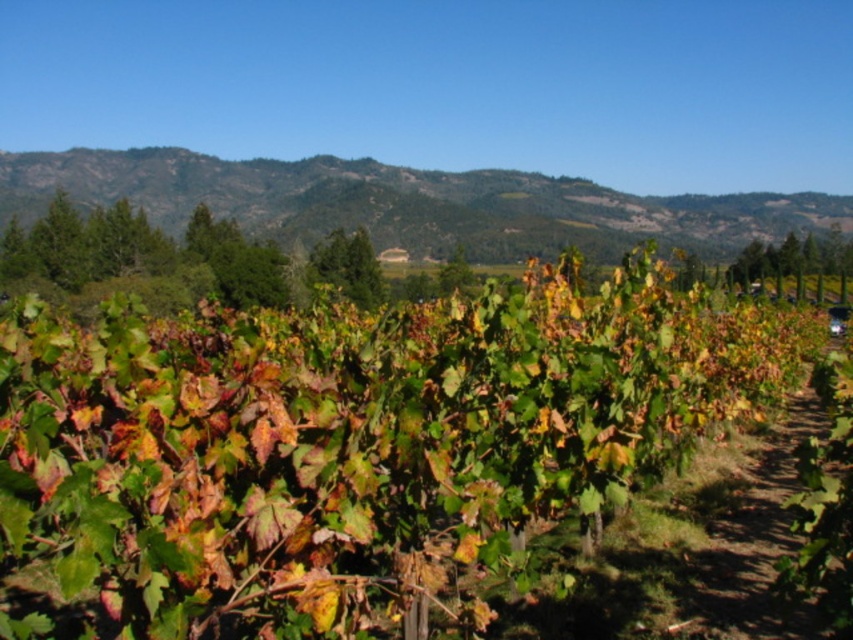
How distant is green leafy vegetation at upper center from dirt path at center?

A distance of 239.55 feet exists between green leafy vegetation at upper center and dirt path at center.

Can you confirm if green leafy vegetation at upper center is shorter than dirt path at center?

In fact, green leafy vegetation at upper center may be taller than dirt path at center.

Is point (341, 224) positioned after point (828, 442)?

Yes, it is behind point (828, 442).

I want to click on green leafy vegetation at upper center, so coord(410,204).